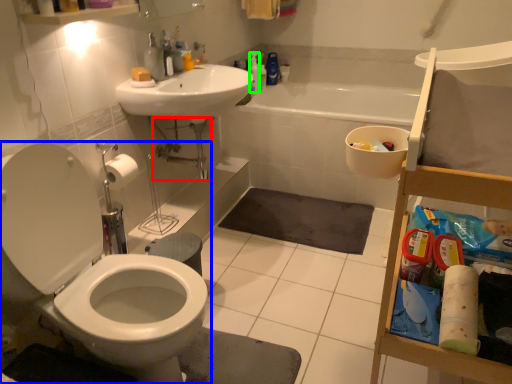
Question: Based on their relative distances, which object is nearer to plumbing fixture (highlighted by a red box)? Choose from toilet (highlighted by a blue box) and cleaning product (highlighted by a green box).

Choices:
 (A) toilet
 (B) cleaning product

Answer: (B)